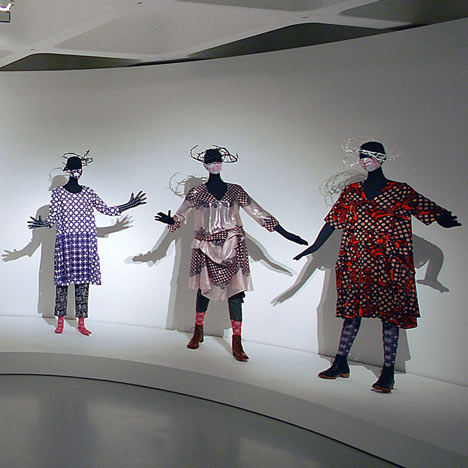
This screenshot has height=468, width=468. What are the coordinates of `manikin` in the screenshot? It's located at (61, 320).